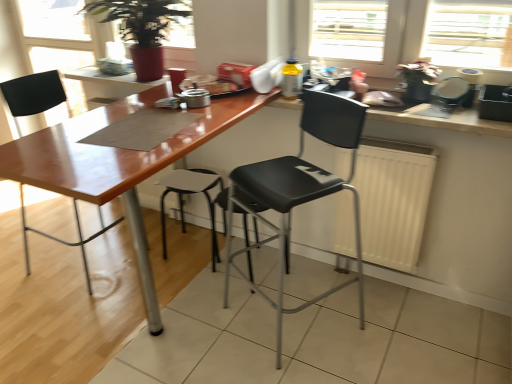
You are a GUI agent. You are given a task and a screenshot of the screen. Output one action in this format:
    pyautogui.click(x=<x>, y=<y>)
    Task: Click on the free region under matte black chair at left, which is the 1th chair from left to right (from a real-world perspective)
    This screenshot has width=512, height=384.
    Given the screenshot: What is the action you would take?
    pyautogui.click(x=81, y=267)